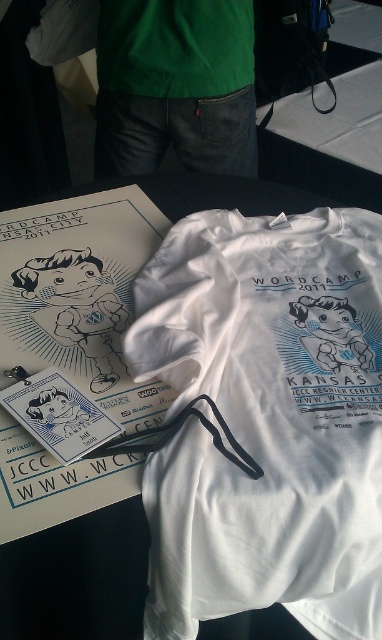
Can you confirm if white cotton t-shirt at center is positioned above matte paper sticker at upper left?

Correct, white cotton t-shirt at center is located above matte paper sticker at upper left.

Can you confirm if white cotton t-shirt at center is wider than matte paper sticker at upper left?

Indeed, white cotton t-shirt at center has a greater width compared to matte paper sticker at upper left.

Is point (278, 301) positioned in front of point (79, 406)?

No, (278, 301) is behind (79, 406).

Where is `white cotton t-shirt at center`? white cotton t-shirt at center is located at coordinates (265, 419).

Between white cotton t-shirt at center and matte plastic badge at center, which one has less height?

Standing shorter between the two is matte plastic badge at center.

Between white cotton t-shirt at center and matte plastic badge at center, which one appears on the left side from the viewer's perspective?

matte plastic badge at center is more to the left.

You are a GUI agent. You are given a task and a screenshot of the screen. Output one action in this format:
    pyautogui.click(x=<x>, y=<y>)
    Task: Click on the white cotton t-shirt at center
    This screenshot has height=640, width=382.
    Given the screenshot: What is the action you would take?
    pyautogui.click(x=265, y=419)

Which is more to the right, matte plastic badge at center or matte paper sticker at upper left?

matte paper sticker at upper left

Who is more forward, [74,406] or [71,435]?

Point [71,435]

Between point (40, 410) and point (29, 404), which one is positioned behind?

The point (29, 404) is behind.

I want to click on matte plastic badge at center, so click(x=56, y=413).